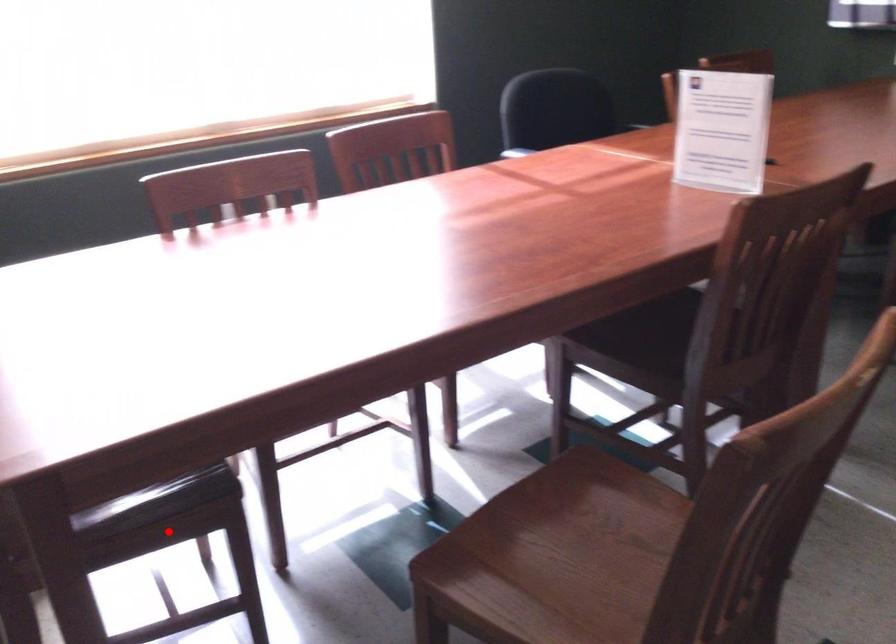
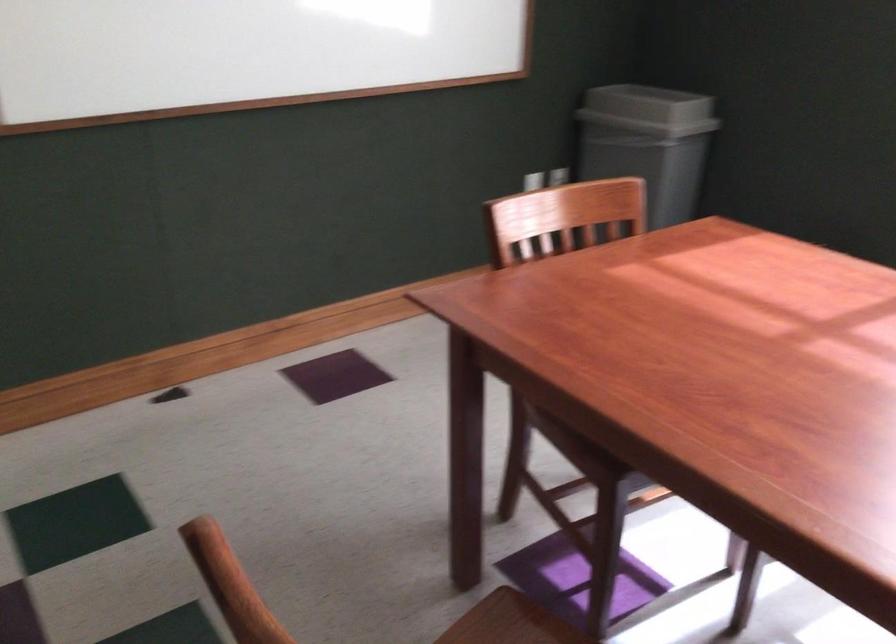
Question: I am providing you with two images of the same scene from different viewpoints. Given a red point in image1, look at the same physical point in image2. Is it:

Choices:
 (A) Closer to the viewpoint
 (B) Farther from the viewpoint

Answer: (B)